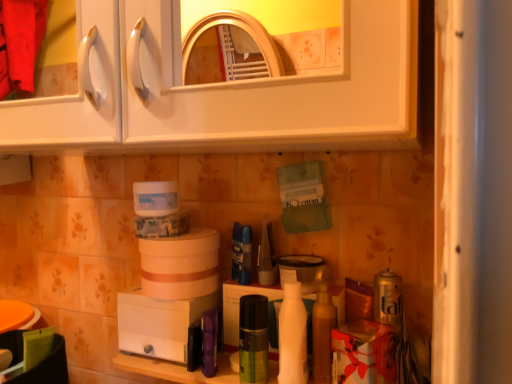
The height and width of the screenshot is (384, 512). Describe the element at coordinates (229, 93) in the screenshot. I see `white glossy cabinet at upper center` at that location.

At what (x,y) coordinates should I click in order to perform the action: click on white plastic humidifier at lower center, placed as the first appliance when sorted from bottom to top. Please return your answer as a coordinate pair (x, y). The width and height of the screenshot is (512, 384). Looking at the image, I should click on (162, 325).

Image resolution: width=512 pixels, height=384 pixels. Describe the element at coordinates (323, 334) in the screenshot. I see `shiny gold lotion at center, the 4th toiletry in the left-to-right sequence` at that location.

Measure the distance between point (210,321) and camera.

The depth of point (210,321) is 32.56 inches.

This screenshot has width=512, height=384. What are the coordinates of `green matte spray can at center, positioned as the second toiletry in left-to-right order` in the screenshot? It's located at (253, 339).

Where is `white glossy cabinet at upper center`? This screenshot has height=384, width=512. white glossy cabinet at upper center is located at coordinates (229, 93).

How far apart are green matte spray can at center, the 4th toiletry in the right-to-left sequence, and silver metallic can at lower right, the first toiletry positioned from the right?

green matte spray can at center, the 4th toiletry in the right-to-left sequence, and silver metallic can at lower right, the first toiletry positioned from the right, are 8.75 inches apart.

Does point (253, 352) lie in front of point (382, 316)?

No, (253, 352) is behind (382, 316).

Locate an element on the screen. The image size is (512, 384). the 2nd toiletry below when counting from the silver metallic can at lower right, which ranks as the 5th toiletry in left-to-right order (from the image's perspective) is located at coordinates (x=253, y=339).

Can you confirm if white glossy cabinet at upper center is thinner than green matte spray can at center, the 4th toiletry in the right-to-left sequence?

Incorrect, the width of white glossy cabinet at upper center is not less than that of green matte spray can at center, the 4th toiletry in the right-to-left sequence.

From the image's perspective, relative to green matte spray can at center, the 4th toiletry in the right-to-left sequence, is white glossy cabinet at upper center above or below?

Based on their image positions, white glossy cabinet at upper center is located above green matte spray can at center, the 4th toiletry in the right-to-left sequence.

Can you confirm if white glossy cabinet at upper center is shorter than green matte spray can at center, the 4th toiletry in the right-to-left sequence?

Incorrect, the height of white glossy cabinet at upper center does not fall short of that of green matte spray can at center, the 4th toiletry in the right-to-left sequence.

Is shiny gold lotion at center, the 2th toiletry viewed from the right, taller than translucent plastic container at center, the 1th appliance viewed from the right?

Yes.

Which is nearer, (324, 337) or (287, 260)?

Point (324, 337) is positioned closer to the camera compared to point (287, 260).

Are shiny gold lotion at center, the 2th toiletry viewed from the right, and translucent plastic container at center, which is counted as the 1th appliance, starting from the top, located far from each other?

Result: No, shiny gold lotion at center, the 2th toiletry viewed from the right, is in close proximity to translucent plastic container at center, which is counted as the 1th appliance, starting from the top.

What's the angular difference between shiny gold lotion at center, the 2th toiletry viewed from the right, and translucent plastic container at center, which is counted as the 1th appliance, starting from the top,'s facing directions?

The angular difference between shiny gold lotion at center, the 2th toiletry viewed from the right, and translucent plastic container at center, which is counted as the 1th appliance, starting from the top, is 0.00637 degrees.

From a real-world perspective, between white plastic humidifier at lower center, which is counted as the second appliance, starting from the top, and shiny gold lotion at center, the 4th toiletry in the left-to-right sequence, who is vertically lower?

From a 3D spatial view, white plastic humidifier at lower center, which is counted as the second appliance, starting from the top, is below.

In the scene shown: Are white plastic humidifier at lower center, the first appliance in the left-to-right sequence, and shiny gold lotion at center, the 4th toiletry in the left-to-right sequence, beside each other?

There is a gap between white plastic humidifier at lower center, the first appliance in the left-to-right sequence, and shiny gold lotion at center, the 4th toiletry in the left-to-right sequence.

Is white plastic humidifier at lower center, the first appliance in the left-to-right sequence, at the left side of shiny gold lotion at center, the 4th toiletry in the left-to-right sequence?

Yes, white plastic humidifier at lower center, the first appliance in the left-to-right sequence, is to the left of shiny gold lotion at center, the 4th toiletry in the left-to-right sequence.

Considering the relative sizes of white plastic humidifier at lower center, the 2th appliance when ordered from right to left, and shiny gold lotion at center, the 2th toiletry viewed from the right, in the image provided, is white plastic humidifier at lower center, the 2th appliance when ordered from right to left, shorter than shiny gold lotion at center, the 2th toiletry viewed from the right,?

Yes, white plastic humidifier at lower center, the 2th appliance when ordered from right to left, is shorter than shiny gold lotion at center, the 2th toiletry viewed from the right.

In terms of height, does matte plastic container at center, positioned as the third toiletry in right-to-left order, look taller or shorter compared to purple plastic spray can at center, the 1th toiletry when ordered from left to right?

In the image, matte plastic container at center, positioned as the third toiletry in right-to-left order, appears to be taller than purple plastic spray can at center, the 1th toiletry when ordered from left to right.

From the image's perspective, is matte plastic container at center, positioned as the third toiletry in right-to-left order, above or below purple plastic spray can at center, arranged as the 5th toiletry when viewed from the right?

matte plastic container at center, positioned as the third toiletry in right-to-left order, is situated higher than purple plastic spray can at center, arranged as the 5th toiletry when viewed from the right, in the image.

Identify the location of the 4th toiletry located above the purple plastic spray can at center, arranged as the 5th toiletry when viewed from the right (from a real-world perspective). (266, 255).

Considering the positions of objects matte plastic container at center, positioned as the third toiletry in right-to-left order, and purple plastic spray can at center, the 1th toiletry when ordered from left to right, in the image provided, who is more to the right, matte plastic container at center, positioned as the third toiletry in right-to-left order, or purple plastic spray can at center, the 1th toiletry when ordered from left to right,?

matte plastic container at center, positioned as the third toiletry in right-to-left order, is more to the right.

Can you confirm if translucent plastic container at center, the 1th appliance viewed from the right, is positioned to the left of purple plastic spray can at center, arranged as the 5th toiletry when viewed from the right?

No.

Considering the sizes of objects translucent plastic container at center, which is counted as the 1th appliance, starting from the top, and purple plastic spray can at center, the 1th toiletry when ordered from left to right, in the image provided, who is bigger, translucent plastic container at center, which is counted as the 1th appliance, starting from the top, or purple plastic spray can at center, the 1th toiletry when ordered from left to right,?

translucent plastic container at center, which is counted as the 1th appliance, starting from the top, is bigger.

Is translucent plastic container at center, the 1th appliance viewed from the right, positioned with its back to purple plastic spray can at center, the 1th toiletry when ordered from left to right?

translucent plastic container at center, the 1th appliance viewed from the right, does not have its back to purple plastic spray can at center, the 1th toiletry when ordered from left to right.

Could you tell me if green matte spray can at center, the 4th toiletry in the right-to-left sequence, is turned towards matte plastic container at center, acting as the third toiletry starting from the left?

No, green matte spray can at center, the 4th toiletry in the right-to-left sequence, is not facing towards matte plastic container at center, acting as the third toiletry starting from the left.

Is green matte spray can at center, positioned as the second toiletry in left-to-right order, placed right next to matte plastic container at center, acting as the third toiletry starting from the left?

No, green matte spray can at center, positioned as the second toiletry in left-to-right order, is not making contact with matte plastic container at center, acting as the third toiletry starting from the left.

From a real-world perspective, is green matte spray can at center, the 4th toiletry in the right-to-left sequence, beneath matte plastic container at center, acting as the third toiletry starting from the left?

Yes.

Which object is further away from the camera taking this photo, green matte spray can at center, the 4th toiletry in the right-to-left sequence, or matte plastic container at center, acting as the third toiletry starting from the left?

matte plastic container at center, acting as the third toiletry starting from the left, is further away from the camera.

Locate an element on the screen. The width and height of the screenshot is (512, 384). the 2nd toiletry directly above the green matte spray can at center, positioned as the second toiletry in left-to-right order (from a real-world perspective) is located at coordinates (388, 299).

Where is `the 2nd toiletry to the right of the white glossy cabinet at upper center, counting from the anchor's position`? This screenshot has width=512, height=384. the 2nd toiletry to the right of the white glossy cabinet at upper center, counting from the anchor's position is located at coordinates 253,339.

Estimate the real-world distances between objects in this image. Which object is closer to white glossy cabinet at upper center, purple plastic spray can at center, the 1th toiletry when ordered from left to right, or silver metallic can at lower right, which ranks as the 5th toiletry in left-to-right order?

The object closer to white glossy cabinet at upper center is silver metallic can at lower right, which ranks as the 5th toiletry in left-to-right order.

Looking at the image, which one is located closer to matte plastic container at center, acting as the third toiletry starting from the left, shiny gold lotion at center, the 2th toiletry viewed from the right, or green matte spray can at center, the 4th toiletry in the right-to-left sequence?

green matte spray can at center, the 4th toiletry in the right-to-left sequence, is positioned closer to the anchor matte plastic container at center, acting as the third toiletry starting from the left.

Looking at the image, which one is located closer to green matte spray can at center, the 4th toiletry in the right-to-left sequence, white plastic humidifier at lower center, placed as the first appliance when sorted from bottom to top, or white glossy bottle at center?

white glossy bottle at center.

Estimate the real-world distances between objects in this image. Which object is closer to shiny gold lotion at center, the 2th toiletry viewed from the right, translucent plastic container at center, which is the second appliance in bottom-to-top order, or white glossy bottle at center?

white glossy bottle at center is positioned closer to the anchor shiny gold lotion at center, the 2th toiletry viewed from the right.

Considering their positions, is silver metallic can at lower right, the first toiletry positioned from the right, positioned closer to green matte spray can at center, the 4th toiletry in the right-to-left sequence, than white glossy cabinet at upper center?

silver metallic can at lower right, the first toiletry positioned from the right.

Considering their positions, is white glossy bottle at center positioned further to silver metallic can at lower right, the first toiletry positioned from the right, than translucent plastic container at center, which is counted as the 1th appliance, starting from the top?

Among the two, white glossy bottle at center is located further to silver metallic can at lower right, the first toiletry positioned from the right.

Considering their positions, is matte plastic container at center, acting as the third toiletry starting from the left, positioned further to white glossy cabinet at upper center than green matte spray can at center, the 4th toiletry in the right-to-left sequence?

green matte spray can at center, the 4th toiletry in the right-to-left sequence, lies further to white glossy cabinet at upper center than the other object.

Which object lies further to the anchor point shiny gold lotion at center, the 4th toiletry in the left-to-right sequence, green matte spray can at center, positioned as the second toiletry in left-to-right order, or white glossy cabinet at upper center?

white glossy cabinet at upper center.

Where is `cleaning product located between purple plastic spray can at center, arranged as the 5th toiletry when viewed from the right, and shiny gold lotion at center, the 4th toiletry in the left-to-right sequence, in the left-right direction`? cleaning product located between purple plastic spray can at center, arranged as the 5th toiletry when viewed from the right, and shiny gold lotion at center, the 4th toiletry in the left-to-right sequence, in the left-right direction is located at coordinates (292, 336).

The image size is (512, 384). Find the location of `cleaning product located between green matte spray can at center, the 4th toiletry in the right-to-left sequence, and shiny gold lotion at center, the 4th toiletry in the left-to-right sequence, in the left-right direction`. cleaning product located between green matte spray can at center, the 4th toiletry in the right-to-left sequence, and shiny gold lotion at center, the 4th toiletry in the left-to-right sequence, in the left-right direction is located at coordinates (x=292, y=336).

Where is `cleaning product between white plastic humidifier at lower center, which is counted as the second appliance, starting from the top, and translucent plastic container at center, which is the 2th appliance in left-to-right order, in the horizontal direction`? The image size is (512, 384). cleaning product between white plastic humidifier at lower center, which is counted as the second appliance, starting from the top, and translucent plastic container at center, which is the 2th appliance in left-to-right order, in the horizontal direction is located at coordinates (292, 336).

Locate an element on the screen. Image resolution: width=512 pixels, height=384 pixels. cleaning product located between purple plastic spray can at center, the 1th toiletry when ordered from left to right, and translucent plastic container at center, which is the second appliance in bottom-to-top order, in the left-right direction is located at coordinates (292, 336).